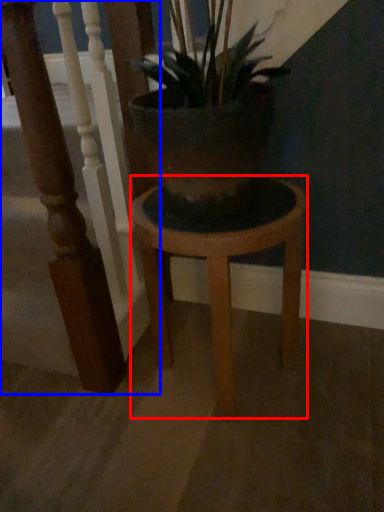
Question: Which point is further to the camera, stool (highlighted by a red box) or rail (highlighted by a blue box)?

Choices:
 (A) stool
 (B) rail

Answer: (A)